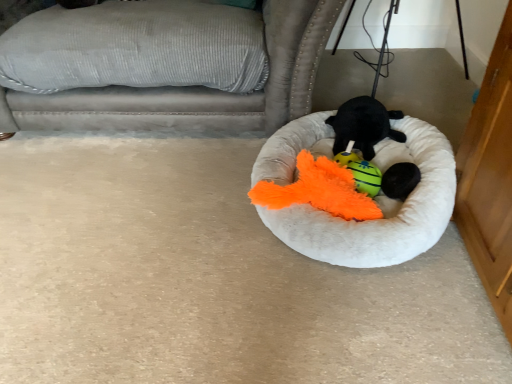
Question: Does fluffy orange toy at center, the second toy in the top-to-bottom sequence, have a greater width compared to soft plush toy at center, which appears as the second toy when ordered from the bottom?

Choices:
 (A) no
 (B) yes

Answer: (A)

Question: From a real-world perspective, is fluffy orange toy at center, the second toy in the top-to-bottom sequence, located beneath soft plush toy at center, which appears as the second toy when ordered from the bottom?

Choices:
 (A) no
 (B) yes

Answer: (B)

Question: Is fluffy orange toy at center, the second toy in the top-to-bottom sequence, closer to camera compared to soft plush toy at center, which appears as the second toy when ordered from the bottom?

Choices:
 (A) no
 (B) yes

Answer: (B)

Question: From the image's perspective, would you say fluffy orange toy at center, the second toy in the top-to-bottom sequence, is positioned over soft plush toy at center, which appears as the second toy when ordered from the bottom?

Choices:
 (A) yes
 (B) no

Answer: (B)

Question: Is fluffy orange toy at center, acting as the first toy starting from the bottom, far away from soft plush toy at center, the 1th toy positioned from the top?

Choices:
 (A) no
 (B) yes

Answer: (A)

Question: Can you confirm if fluffy orange toy at center, the second toy in the top-to-bottom sequence, is taller than soft plush toy at center, which appears as the second toy when ordered from the bottom?

Choices:
 (A) no
 (B) yes

Answer: (A)

Question: Is white fluffy dog bed at center in front of soft plush toy at center, which appears as the second toy when ordered from the bottom?

Choices:
 (A) yes
 (B) no

Answer: (A)

Question: Considering the relative positions of white fluffy dog bed at center and soft plush toy at center, the 1th toy positioned from the top, in the image provided, is white fluffy dog bed at center to the right of soft plush toy at center, the 1th toy positioned from the top, from the viewer's perspective?

Choices:
 (A) no
 (B) yes

Answer: (A)

Question: Does white fluffy dog bed at center have a greater width compared to soft plush toy at center, the 1th toy positioned from the top?

Choices:
 (A) yes
 (B) no

Answer: (A)

Question: Are white fluffy dog bed at center and soft plush toy at center, which appears as the second toy when ordered from the bottom, far apart?

Choices:
 (A) yes
 (B) no

Answer: (B)

Question: From a real-world perspective, is white fluffy dog bed at center over soft plush toy at center, the 1th toy positioned from the top?

Choices:
 (A) no
 (B) yes

Answer: (A)

Question: Is white fluffy dog bed at center oriented away from soft plush toy at center, the 1th toy positioned from the top?

Choices:
 (A) no
 (B) yes

Answer: (B)

Question: Considering the relative sizes of black fuzzy ball at center and gray corduroy couch at upper left in the image provided, is black fuzzy ball at center thinner than gray corduroy couch at upper left?

Choices:
 (A) yes
 (B) no

Answer: (A)